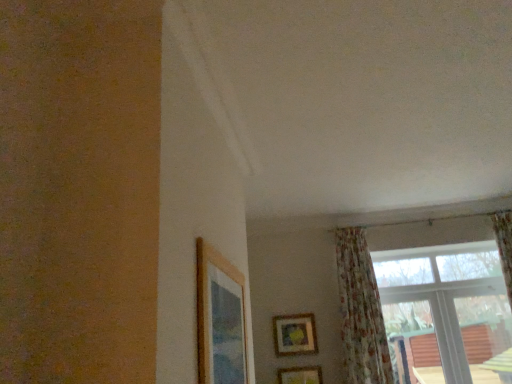
Question: Considering the positions of transparent glass window at upper right and wooden picture frame at upper left, arranged as the third picture frame when ordered from the bottom, in the image, is transparent glass window at upper right wider or thinner than wooden picture frame at upper left, arranged as the third picture frame when ordered from the bottom,?

Choices:
 (A) wide
 (B) thin

Answer: (A)

Question: Looking at the image, does transparent glass window at upper right seem bigger or smaller compared to wooden picture frame at upper left, marked as the third picture frame in a right-to-left arrangement?

Choices:
 (A) small
 (B) big

Answer: (B)

Question: Which object is positioned farthest from the wooden picture frame at upper left, which ranks as the first picture frame in front-to-back order?

Choices:
 (A) wooden picture frame at upper center, positioned as the 1th picture frame in right-to-left order
 (B) wooden picture frame at lower center, which is counted as the second picture frame, starting from the right
 (C) transparent glass window at upper right
 (D) floral fabric curtain at lower right

Answer: (C)

Question: Estimate the real-world distances between objects in this image. Which object is farther from the wooden picture frame at upper left, arranged as the third picture frame when ordered from the bottom?

Choices:
 (A) wooden picture frame at lower center, which is counted as the second picture frame, starting from the top
 (B) floral fabric curtain at lower right
 (C) transparent glass window at upper right
 (D) wooden picture frame at upper center, marked as the 3th picture frame in a top-to-bottom arrangement

Answer: (C)